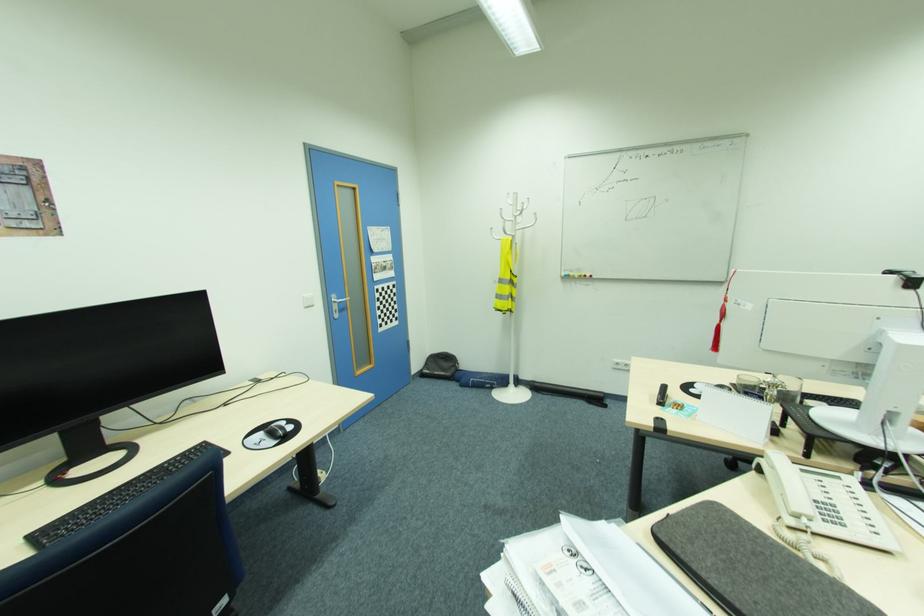
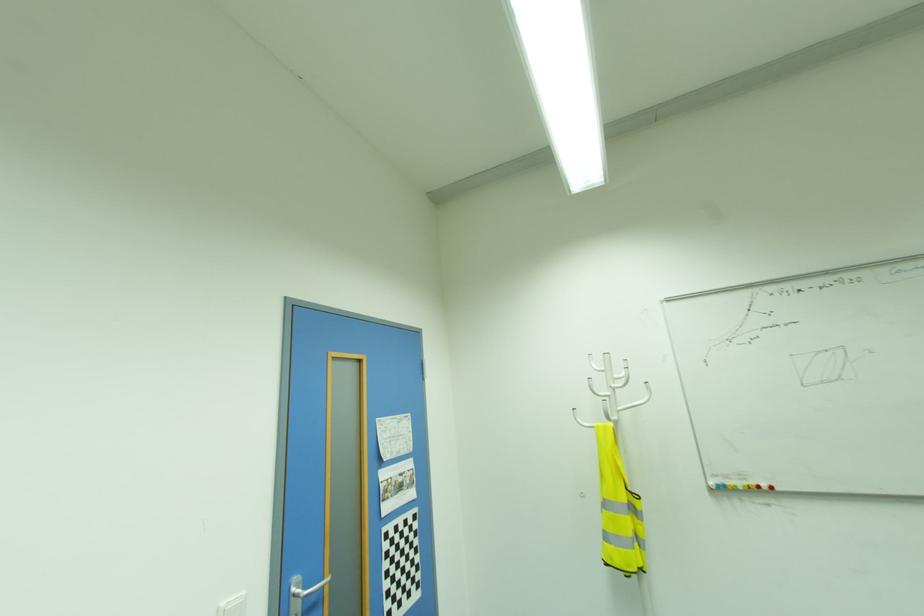
In the second image, find the point that corresponds to pixel 309 296 in the first image.

(226, 602)